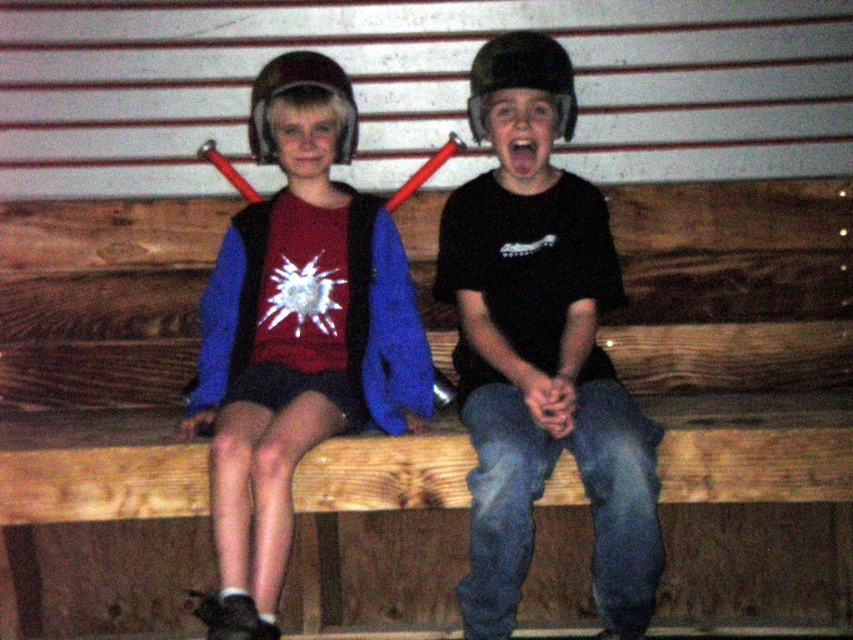
Question: Estimate the real-world distances between objects in this image. Which object is closer to the matte black helmet at center?

Choices:
 (A) matte black helmet at left
 (B) matte plastic helmet at upper center
 (C) black matte helmet at center

Answer: (C)

Question: From the image, what is the correct spatial relationship of matte black helmet at left in relation to matte plastic helmet at upper center?

Choices:
 (A) below
 (B) above

Answer: (A)

Question: Is black matte helmet at center above matte black helmet at center?

Choices:
 (A) yes
 (B) no

Answer: (B)

Question: Can you confirm if black matte helmet at center is positioned to the left of matte plastic helmet at upper center?

Choices:
 (A) no
 (B) yes

Answer: (A)

Question: Which object appears farthest from the camera in this image?

Choices:
 (A) black matte helmet at center
 (B) matte plastic helmet at upper center
 (C) matte black helmet at left

Answer: (B)

Question: Among these points, which one is farthest from the camera?

Choices:
 (A) (418, 394)
 (B) (271, 147)
 (C) (474, 81)
 (D) (486, 372)

Answer: (A)